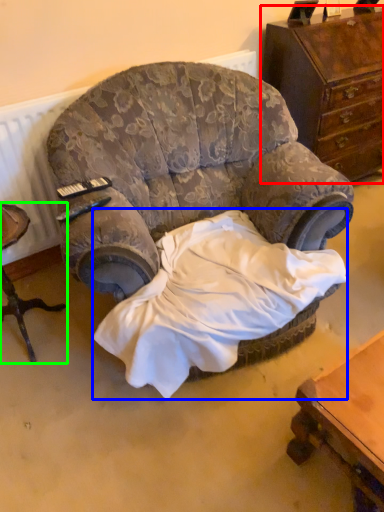
Question: Considering the real-world distances, which object is closest to chest of drawers (highlighted by a red box)? sheet (highlighted by a blue box) or furniture (highlighted by a green box).

Choices:
 (A) sheet
 (B) furniture

Answer: (A)